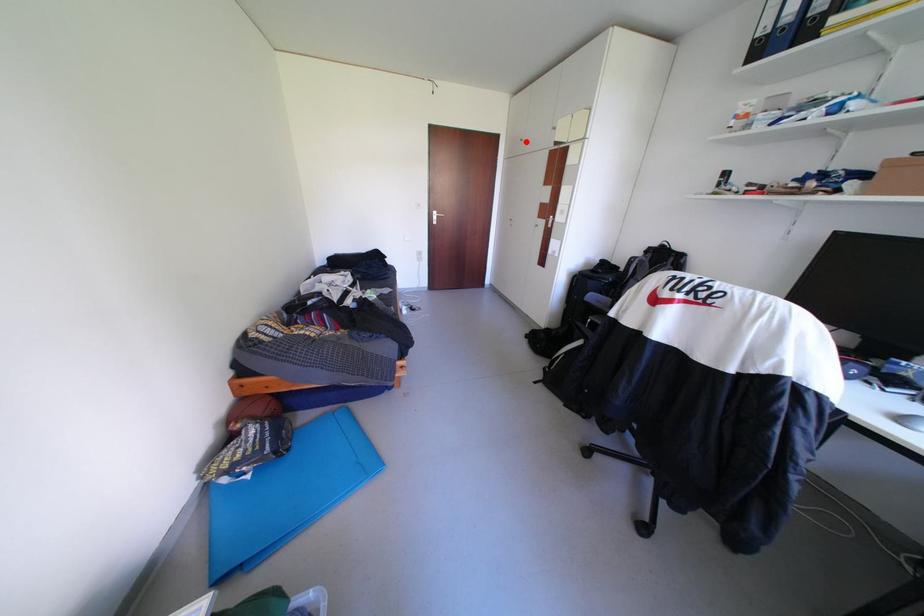
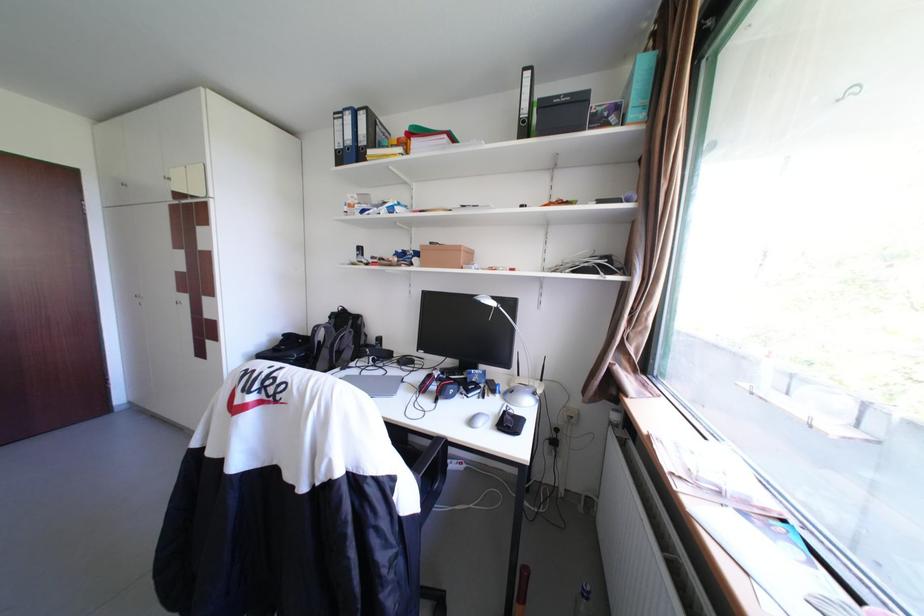
The point at the highlighted location is marked in the first image. Where is the corresponding point in the second image?

(130, 185)